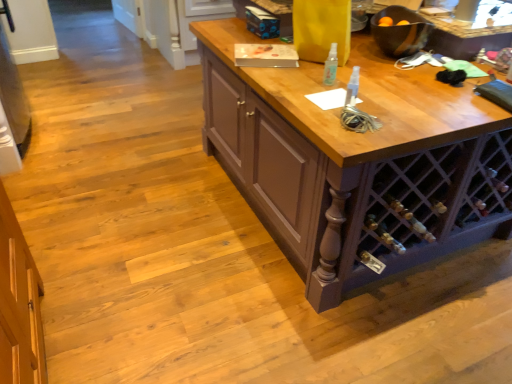
What do you see at coordinates (383, 234) in the screenshot? This screenshot has height=384, width=512. I see `metallic silver wine bottle at lower right` at bounding box center [383, 234].

You are a GUI agent. You are given a task and a screenshot of the screen. Output one action in this format:
    pyautogui.click(x=<x>, y=<y>)
    Task: Click on the metallic silver wine bottle at lower right
    This screenshot has width=512, height=384.
    Given the screenshot: What is the action you would take?
    pyautogui.click(x=383, y=234)

What is the approximate width of metallic silver wine bottle at lower right?

metallic silver wine bottle at lower right is 8.72 inches in width.

At what (x,y) coordinates should I click in order to perform the action: click on clear plastic spray bottle at center. Please return your answer as a coordinate pair (x, y). Looking at the image, I should click on (331, 66).

Describe the element at coordinates (331, 66) in the screenshot. I see `clear plastic spray bottle at center` at that location.

Image resolution: width=512 pixels, height=384 pixels. I want to click on metallic silver wine bottle at lower right, so click(x=383, y=234).

From the picture: Can you confirm if clear plastic spray bottle at center is positioned to the left of metallic silver wine bottle at lower right?

Correct, you'll find clear plastic spray bottle at center to the left of metallic silver wine bottle at lower right.

Considering their positions, is clear plastic spray bottle at center located in front of or behind metallic silver wine bottle at lower right?

Clearly, clear plastic spray bottle at center is in front of metallic silver wine bottle at lower right.

Which is in front, point (335, 59) or point (384, 238)?

The point (384, 238) is closer to the camera.

From the image's perspective, is clear plastic spray bottle at center located above or below metallic silver wine bottle at lower right?

Clearly, from the image's perspective, clear plastic spray bottle at center is above metallic silver wine bottle at lower right.

Based on the photo, from a real-world perspective, who is located lower, clear plastic spray bottle at center or metallic silver wine bottle at lower right?

metallic silver wine bottle at lower right.

Considering the relative sizes of clear plastic spray bottle at center and metallic silver wine bottle at lower right in the image provided, is clear plastic spray bottle at center thinner than metallic silver wine bottle at lower right?

Yes.

Can you confirm if clear plastic spray bottle at center is taller than metallic silver wine bottle at lower right?

Yes.

Which of these two, clear plastic spray bottle at center or metallic silver wine bottle at lower right, is bigger?

metallic silver wine bottle at lower right.

Would you say metallic silver wine bottle at lower right is part of clear plastic spray bottle at center's contents?

No.

Is there a large distance between clear plastic spray bottle at center and metallic silver wine bottle at lower right?

No.

Could you tell me if clear plastic spray bottle at center is turned towards metallic silver wine bottle at lower right?

No, clear plastic spray bottle at center is not turned towards metallic silver wine bottle at lower right.

Looking at this image, how far apart are clear plastic spray bottle at center and metallic silver wine bottle at lower right?

clear plastic spray bottle at center and metallic silver wine bottle at lower right are 61.04 centimeters apart from each other.

At what (x,y) coordinates should I click in order to perform the action: click on bottle in front of the metallic silver wine bottle at lower right. Please return your answer as a coordinate pair (x, y). This screenshot has width=512, height=384. Looking at the image, I should click on (331, 66).

Does metallic silver wine bottle at lower right appear on the right side of clear plastic spray bottle at center?

Yes, metallic silver wine bottle at lower right is to the right of clear plastic spray bottle at center.

Which object is closer to the camera, metallic silver wine bottle at lower right or clear plastic spray bottle at center?

clear plastic spray bottle at center is in front.

Is point (373, 219) closer or farther from the camera than point (331, 59)?

Point (373, 219) is closer to the camera than point (331, 59).

From the image's perspective, between metallic silver wine bottle at lower right and clear plastic spray bottle at center, which one is located above?

From the image's view, clear plastic spray bottle at center is above.

From a real-world perspective, is metallic silver wine bottle at lower right below clear plastic spray bottle at center?

Correct, in the physical world, metallic silver wine bottle at lower right is lower than clear plastic spray bottle at center.

Between metallic silver wine bottle at lower right and clear plastic spray bottle at center, which one has larger width?

Wider between the two is metallic silver wine bottle at lower right.

Which of these two, metallic silver wine bottle at lower right or clear plastic spray bottle at center, stands shorter?

metallic silver wine bottle at lower right.

Can you confirm if metallic silver wine bottle at lower right is smaller than clear plastic spray bottle at center?

No.

Is metallic silver wine bottle at lower right inside or outside of clear plastic spray bottle at center?

metallic silver wine bottle at lower right is outside clear plastic spray bottle at center.

Is the surface of metallic silver wine bottle at lower right in direct contact with clear plastic spray bottle at center?

metallic silver wine bottle at lower right and clear plastic spray bottle at center are not in contact.

Is metallic silver wine bottle at lower right turned away from clear plastic spray bottle at center?

That's not correct — metallic silver wine bottle at lower right is not looking away from clear plastic spray bottle at center.

How different are the orientations of metallic silver wine bottle at lower right and clear plastic spray bottle at center in degrees?

177 degrees separate the facing orientations of metallic silver wine bottle at lower right and clear plastic spray bottle at center.

At what (x,y) coordinates should I click in order to perform the action: click on bottle above the metallic silver wine bottle at lower right (from a real-world perspective). Please return your answer as a coordinate pair (x, y). The image size is (512, 384). Looking at the image, I should click on (331, 66).

Find the location of `wine bottle that is under the clear plastic spray bottle at center (from a real-world perspective)`. wine bottle that is under the clear plastic spray bottle at center (from a real-world perspective) is located at coordinates (383, 234).

Find the location of a particular element. The image size is (512, 384). wine bottle below the clear plastic spray bottle at center (from the image's perspective) is located at coordinates tap(383, 234).